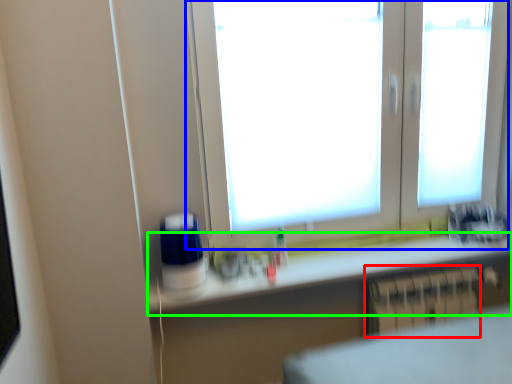
Question: Estimate the real-world distances between objects in this image. Which object is closer to radiator (highlighted by a red box), window (highlighted by a blue box) or counter top (highlighted by a green box)?

Choices:
 (A) window
 (B) counter top

Answer: (B)